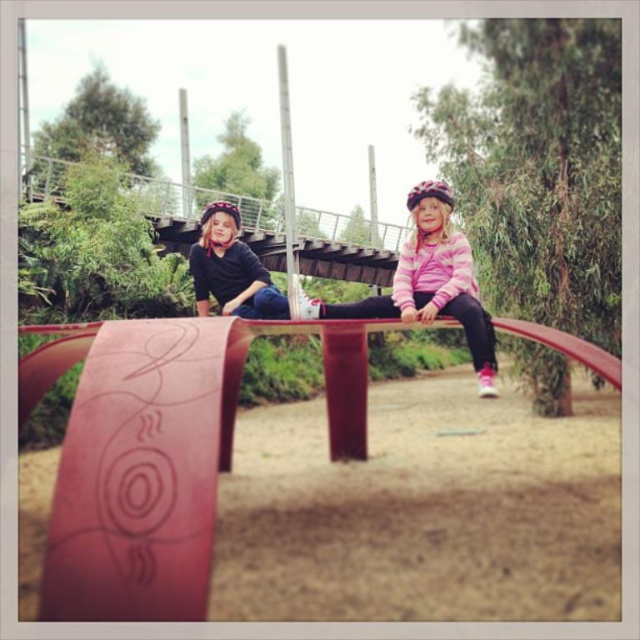
Between pink striped sweater at center and matte black helmet at upper center, which one has more height?

pink striped sweater at center is taller.

Does pink striped sweater at center have a lesser width compared to matte black helmet at upper center?

No.

Locate an element on the screen. pink striped sweater at center is located at coordinates [x=428, y=282].